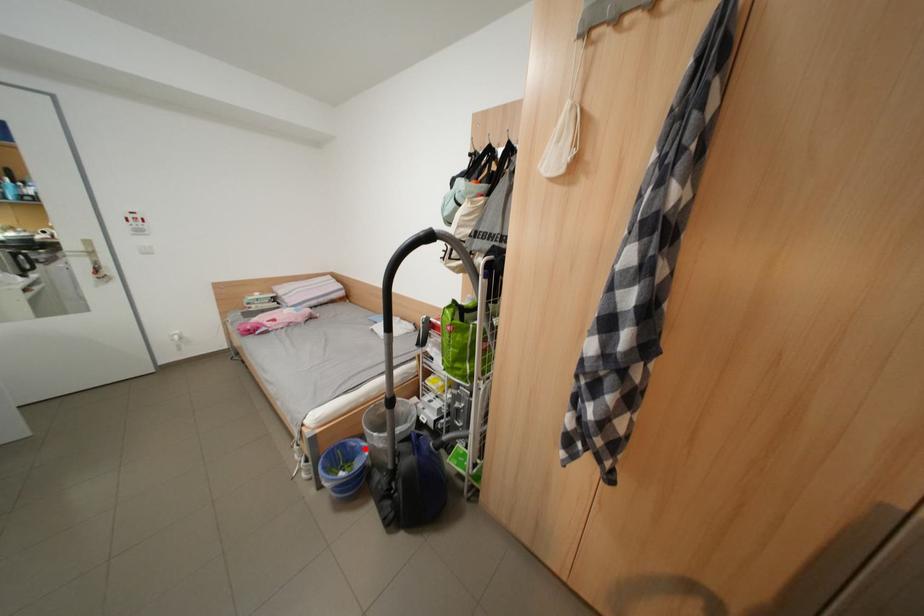
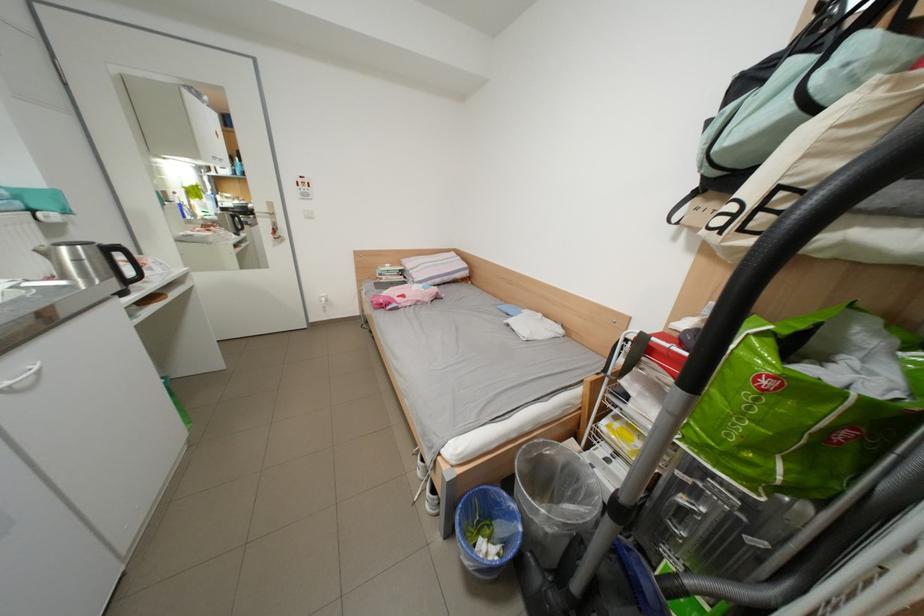
Question: I am providing you with two images of the same scene from different viewpoints. Given a red point in image1, look at the same physical point in image2. Is it:

Choices:
 (A) Closer to the viewpoint
 (B) Farther from the viewpoint

Answer: (A)